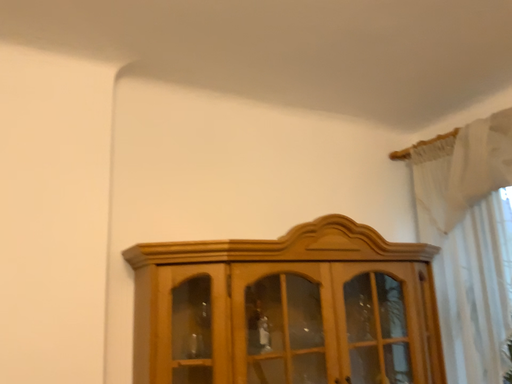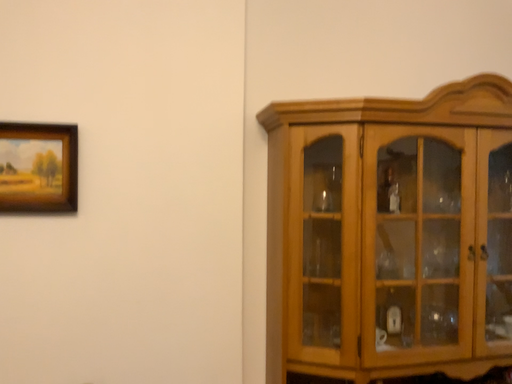
Question: How did the camera likely rotate when shooting the video?

Choices:
 (A) rotated left
 (B) rotated right

Answer: (A)